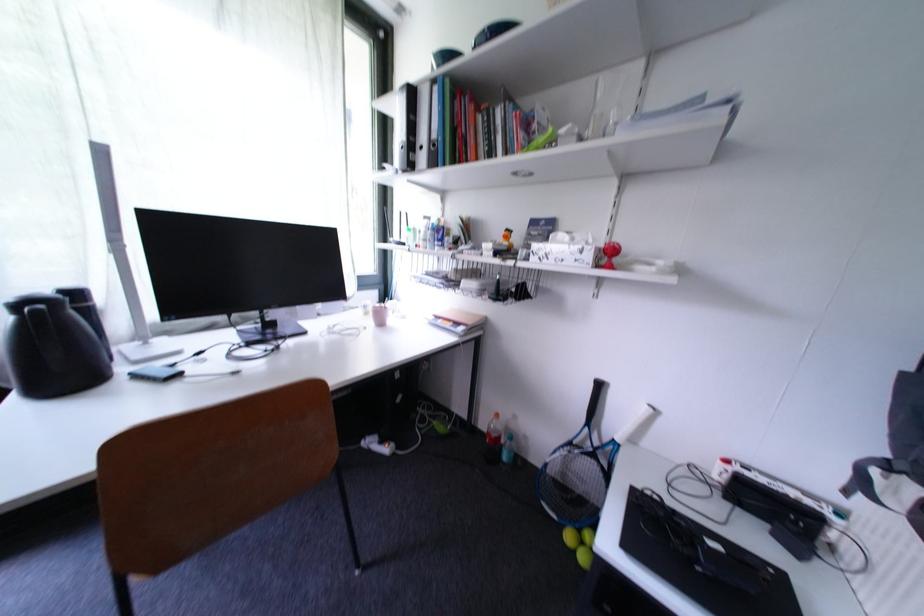
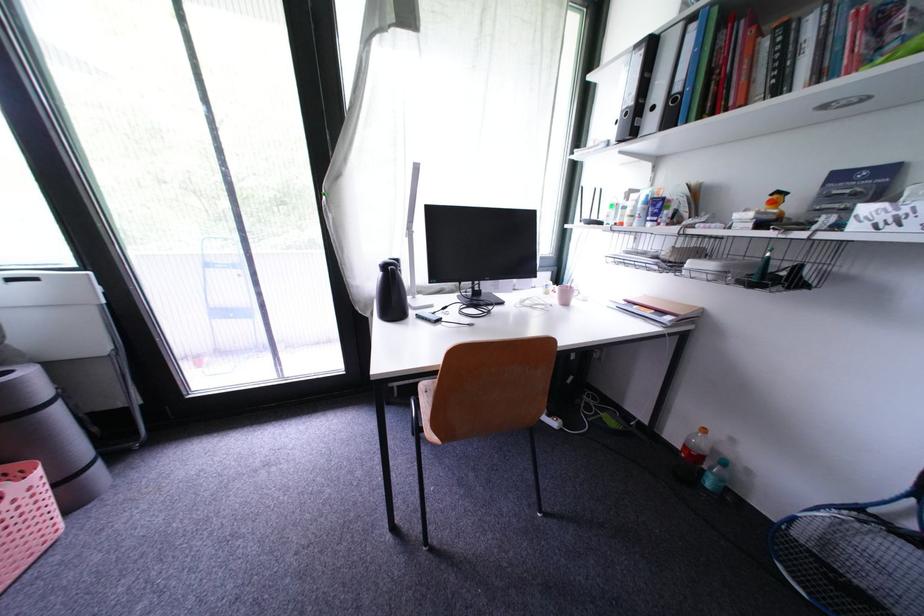
Where in the second image is the point corresponding to point (64, 314) from the first image?

(398, 274)